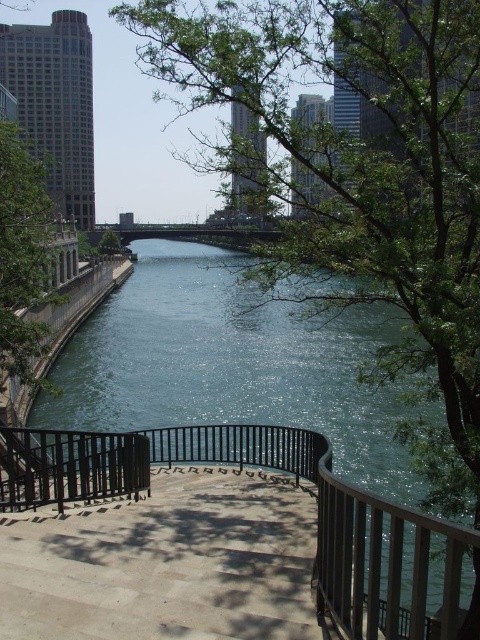
Consider the image. You are standing on the curved staircase and want to walk towards the river. Which direction should you go to avoid the green leafy tree at center and the green leafy tree at left?

The green leafy tree at left is positioned on the right side of green leafy tree at center. To avoid both trees, you should walk towards the right side of the green leafy tree at center, which is where the green leafy tree at left is not located.

You are standing at the top of the curved staircase in the urban riverside scene. You want to walk down the stairs to get closer to the river. How far will you have to walk from your current position to reach the black metal railing at center?

You will have to walk 5.75 meters to reach the black metal railing at center.

In the scene shown: You are a bird looking for a place to perch. Both the green leafy tree at left and the green leafy tree at center are in your sight. Which tree would you choose if you want to land on the taller one?

The green leafy tree at left is taller than the green leafy tree at center, so you should choose the green leafy tree at left to land on.